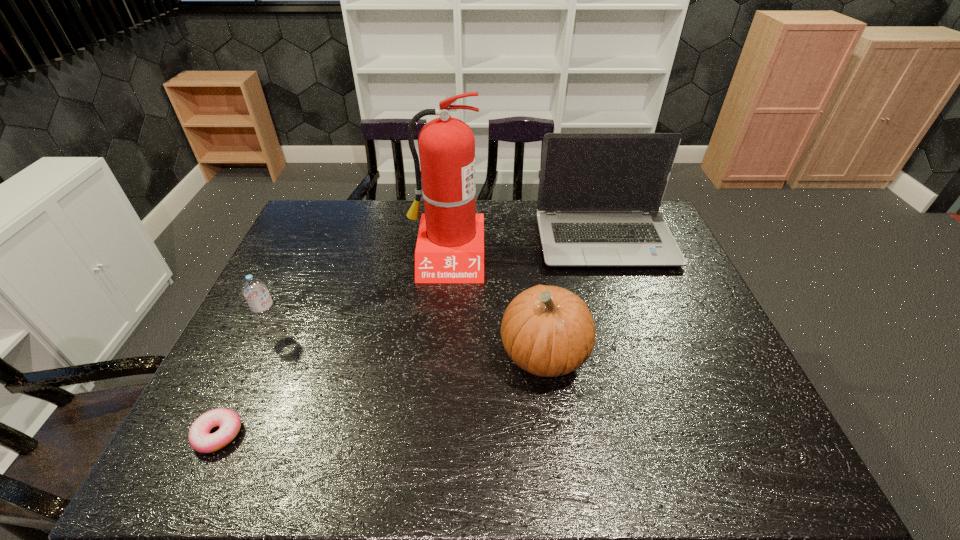
You are a GUI agent. You are given a task and a screenshot of the screen. Output one action in this format:
    pyautogui.click(x=<x>, y=<y>)
    Task: Click on the fire extinguisher
    The image size is (960, 540).
    Given the screenshot: What is the action you would take?
    pyautogui.click(x=450, y=245)

This screenshot has width=960, height=540. Find the location of `the third object from left to right`. the third object from left to right is located at coordinates (450, 245).

You are a GUI agent. You are given a task and a screenshot of the screen. Output one action in this format:
    pyautogui.click(x=<x>, y=<y>)
    Task: Click on the laptop computer
    
    Given the screenshot: What is the action you would take?
    pyautogui.click(x=599, y=195)

Where is `pumpkin`? The height and width of the screenshot is (540, 960). pumpkin is located at coordinates (548, 331).

Where is `water bottle`? The image size is (960, 540). water bottle is located at coordinates (255, 291).

Image resolution: width=960 pixels, height=540 pixels. What are the coordinates of `the nearest object` in the screenshot? It's located at (200, 439).

Identify the location of the shortest object. (200, 439).

Identify the location of free space located on the front-facing side of the tallest object. (x=440, y=340).

This screenshot has height=540, width=960. Find the location of `vacant area situated on the screen of the laptop computer`. vacant area situated on the screen of the laptop computer is located at coordinates (636, 330).

Where is `vacant space located 0.310m on the stem of the pumpkin`? This screenshot has width=960, height=540. vacant space located 0.310m on the stem of the pumpkin is located at coordinates (377, 354).